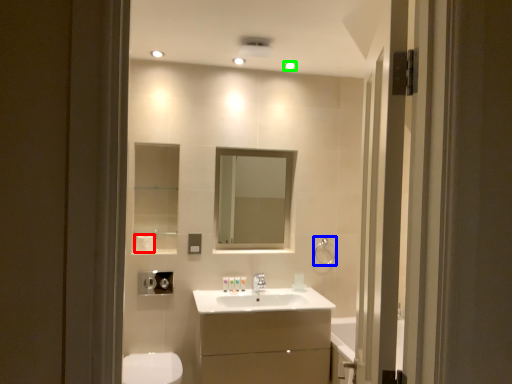
Question: Which is nearer to the toilet paper (highlighted by a red box)? towel bar (highlighted by a blue box) or light fixture (highlighted by a green box).

Choices:
 (A) towel bar
 (B) light fixture

Answer: (A)